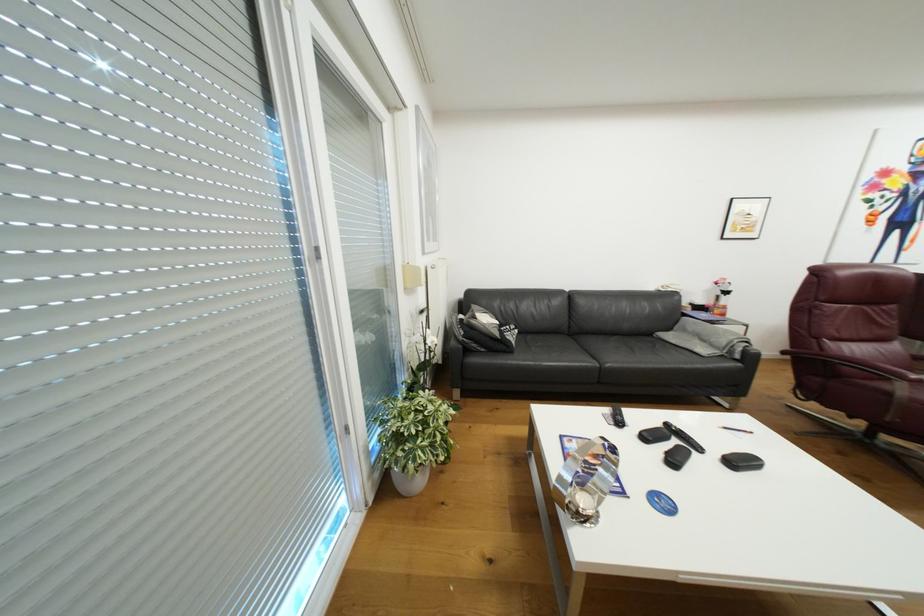
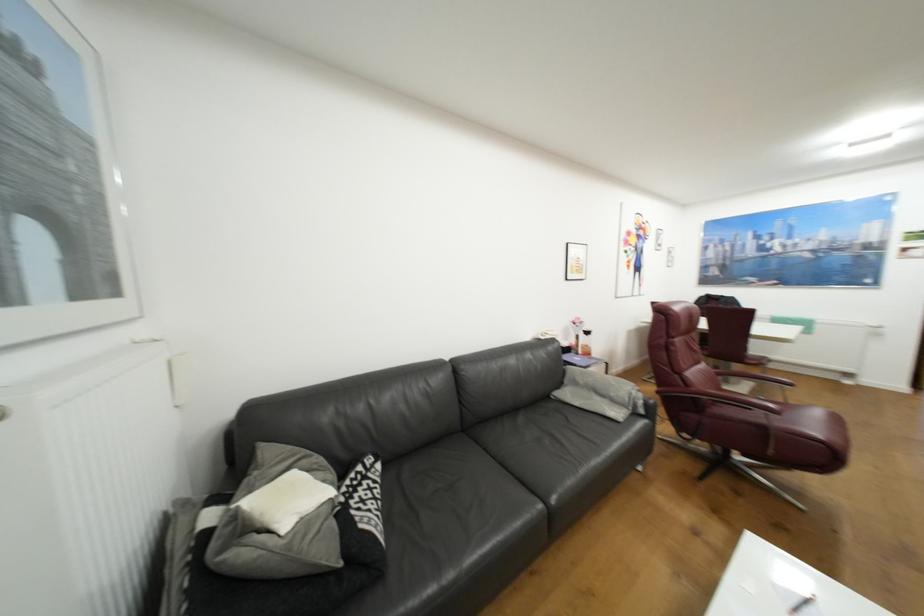
In the second image, find the point that corresponds to the point at 724,297 in the first image.

(584, 336)